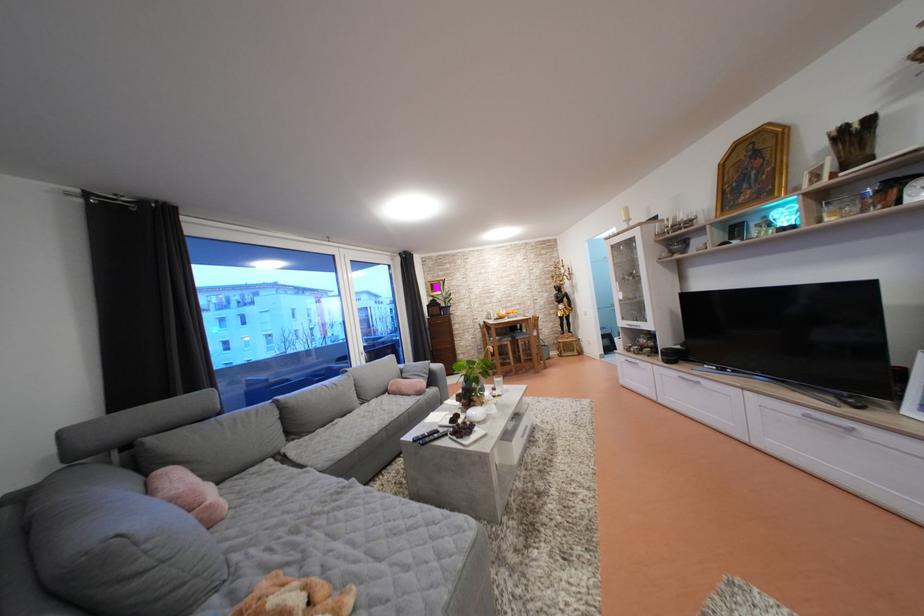
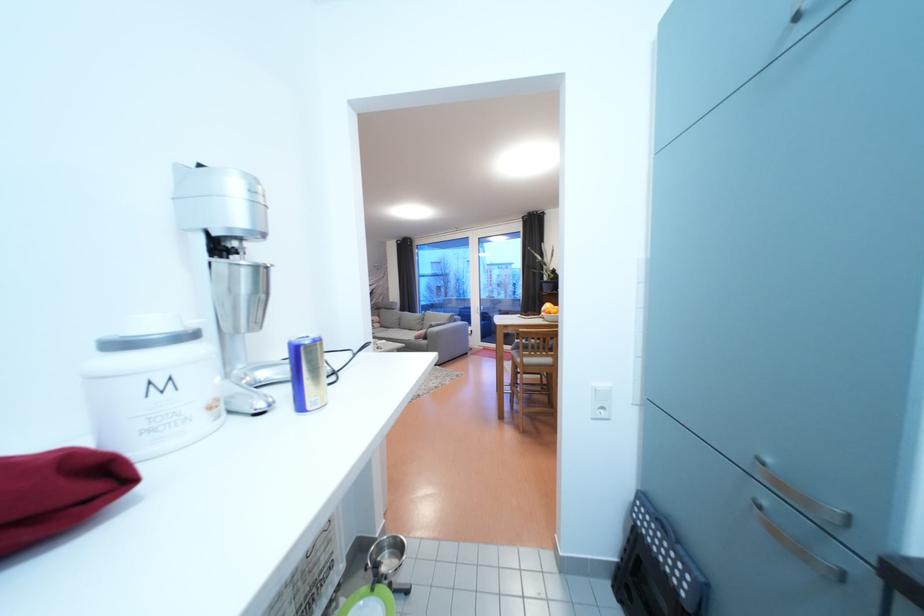
Question: I am providing you with two images of the same scene from different viewpoints. Which of the following objects are not visible in image2?

Choices:
 (A) wooden chair sitting surface
 (B) orange fruit
 (C) black desk fan
 (D) blue drink can

Answer: (A)